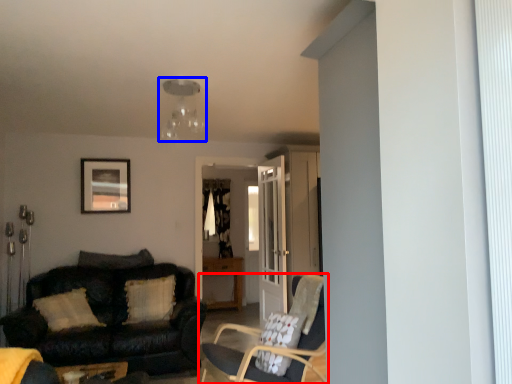
Question: Which of the following is the closest to the observer, chair (highlighted by a red box) or light fixture (highlighted by a blue box)?

Choices:
 (A) chair
 (B) light fixture

Answer: (A)